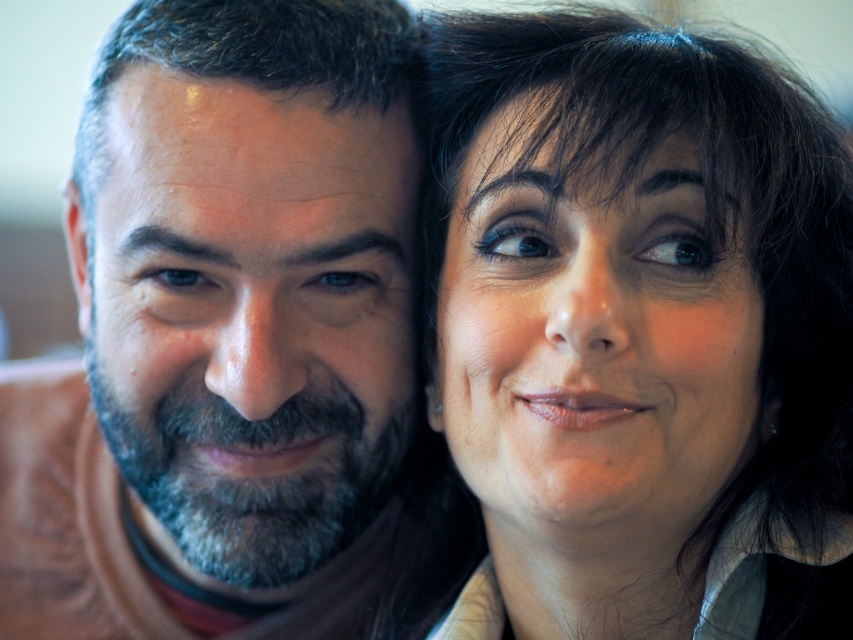
Consider the image. Between smooth black hair at upper right and brown matte shirt at left, which one appears on the left side from the viewer's perspective?

Positioned to the left is brown matte shirt at left.

Is smooth black hair at upper right taller than brown matte shirt at left?

Result: No, smooth black hair at upper right is not taller than brown matte shirt at left.

Does point (848, 275) come behind point (303, 563)?

That is False.

Where is `smooth black hair at upper right`? Image resolution: width=853 pixels, height=640 pixels. smooth black hair at upper right is located at coordinates (640, 330).